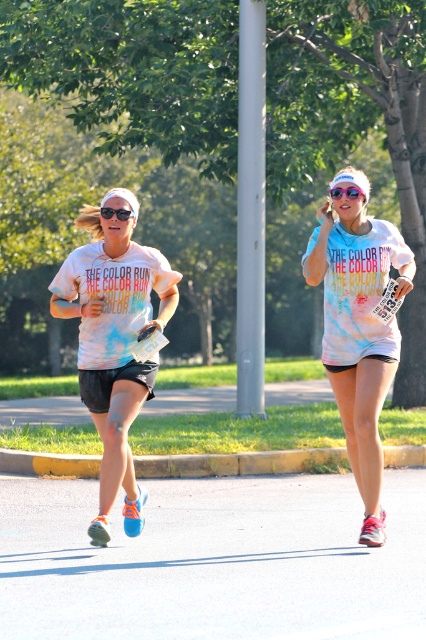
You are a photographer standing at the starting line of The Color Run. You want to take a photo that includes both the point at (339, 280) and the point at (124, 211). Which point should you focus on first to ensure both are in focus?

You should focus on the point at (124, 211) first because it is closer to you than the point at (339, 280), which is further away. This way, both points will be within the depth of field.